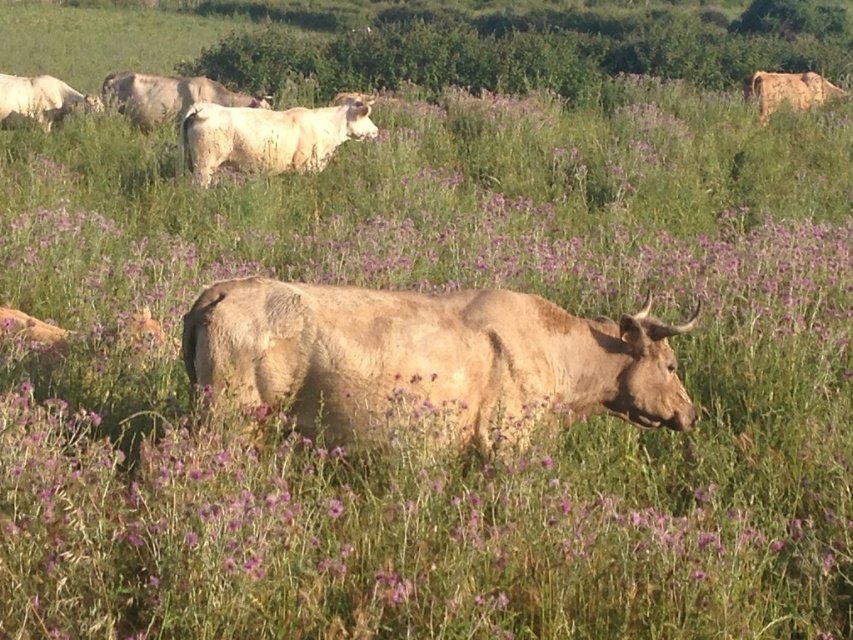
Question: Which object is farther from the camera taking this photo?

Choices:
 (A) light brown cow at upper center
 (B) white textured cow at upper center
 (C) light brown textured cow at upper right

Answer: (C)

Question: Is white textured cow at upper center further to the viewer compared to light brown textured cow at upper right?

Choices:
 (A) no
 (B) yes

Answer: (A)

Question: In this image, where is light brown textured bull at center located relative to white textured cow at upper center?

Choices:
 (A) right
 (B) left

Answer: (A)

Question: Which point is closer to the camera?

Choices:
 (A) (625, 392)
 (B) (271, 141)
 (C) (769, 104)
 (D) (175, 84)

Answer: (A)

Question: Among these points, which one is farthest from the camera?

Choices:
 (A) (440, 310)
 (B) (178, 115)
 (C) (805, 104)
 (D) (206, 176)

Answer: (C)

Question: Observing the image, what is the correct spatial positioning of light brown textured bull at center in reference to white textured cow at upper center?

Choices:
 (A) right
 (B) left

Answer: (A)